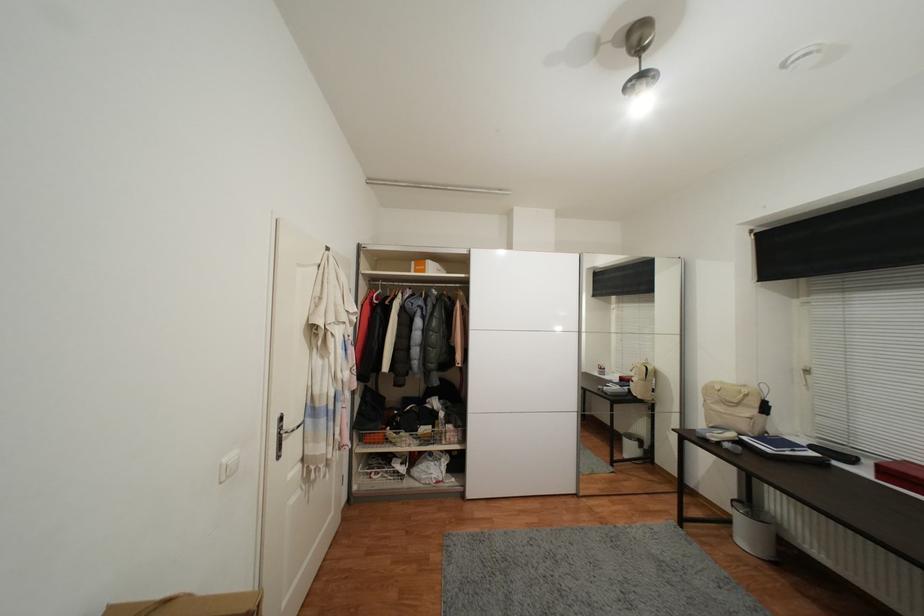
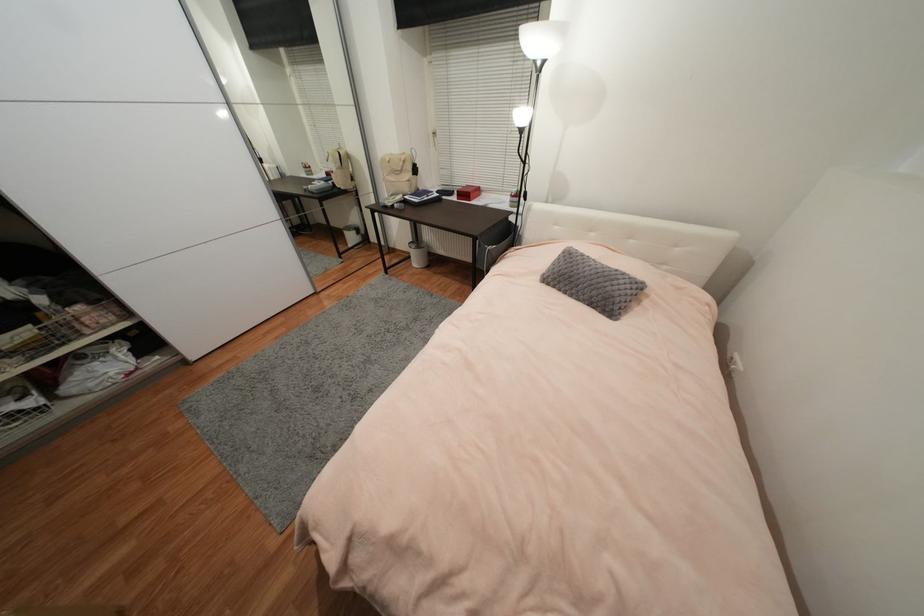
Based on the continuous images, in which direction is the camera rotating?

The rotation direction of the camera is right-down.